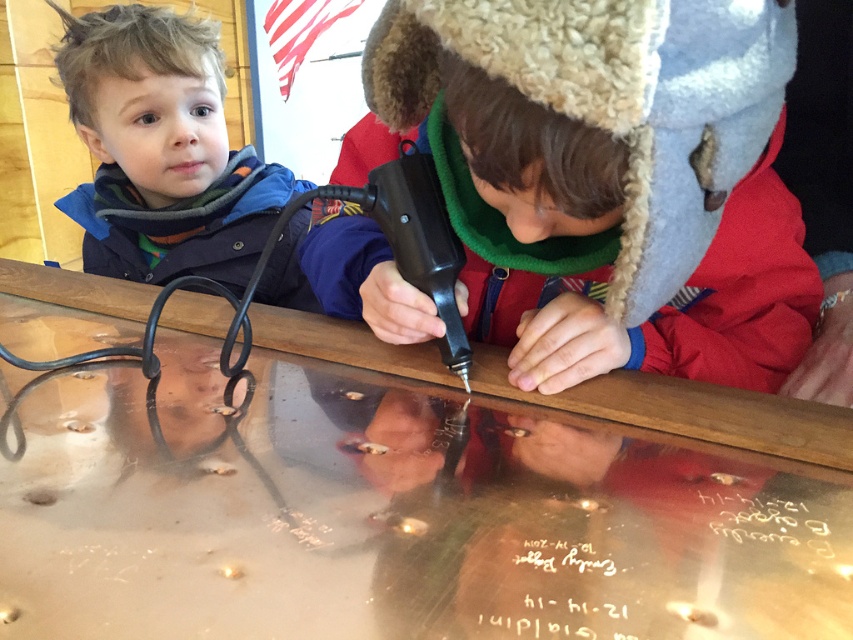
You are a photographer standing at a safe distance from the matte black glue gun at center. You need to capture a clear photo of the glue gun without any blur caused by motion. The camera you are using has a minimum focus distance of 16 inches. Can you take the photo from your current position?

The distance between the matte black glue gun at center and the camera is 16.45 inches, which is slightly more than the camera minimum focus distance of 16 inches. Therefore, you can take the photo from your current position without any blur caused by motion.

From the picture: You are standing in front of the metallic surface where the child is working. Can you tell me what object is located at the coordinate point [392,515] on this surface?

The point [392,515] corresponds to the metallic polished table at center.